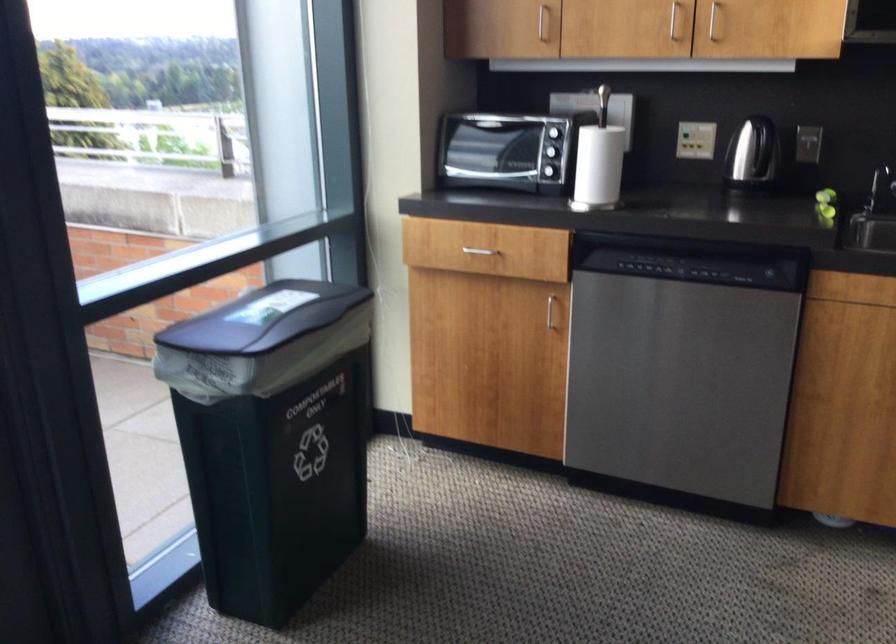
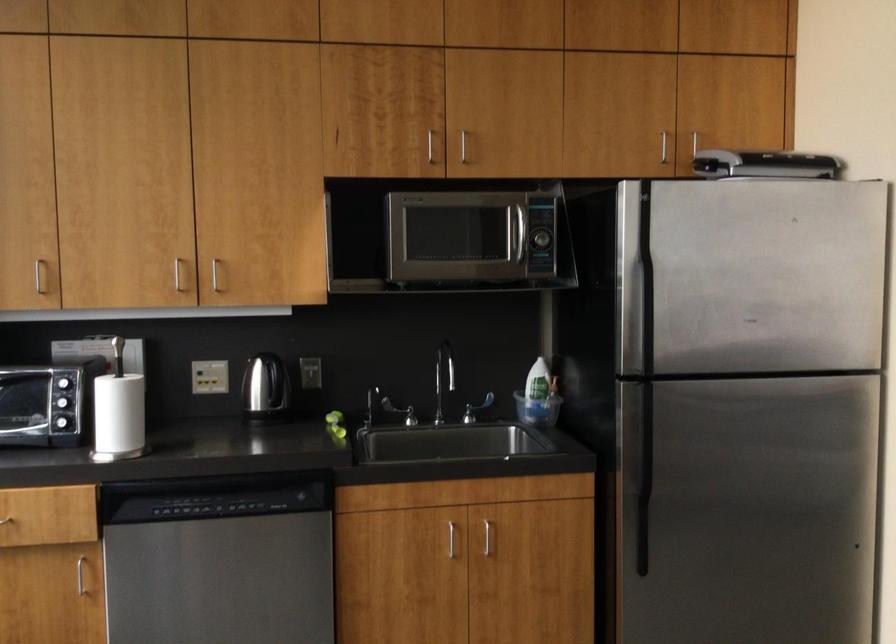
The point at (583, 164) is marked in the first image. Where is the corresponding point in the second image?

(117, 415)